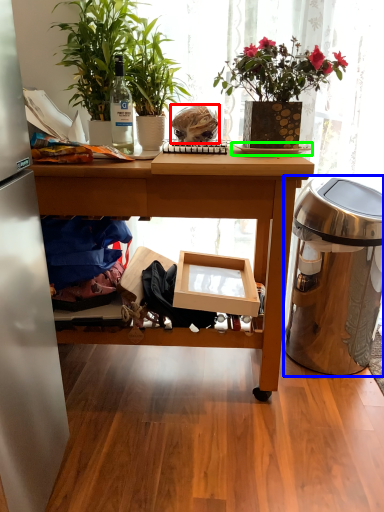
Question: Considering the real-world distances, which object is farthest from food (highlighted by a red box)? trash bin/can (highlighted by a blue box) or plate (highlighted by a green box)?

Choices:
 (A) trash bin/can
 (B) plate

Answer: (A)